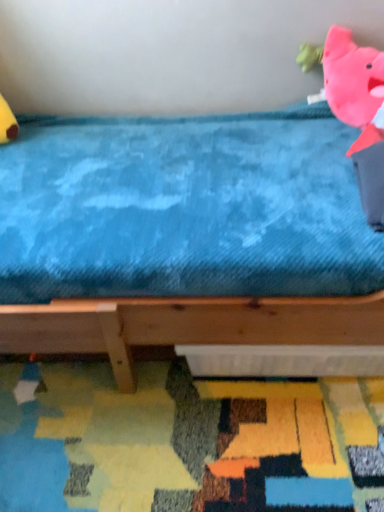
Question: Is pink plush toy at upper right at the right side of textured multicolored mat at lower center?

Choices:
 (A) yes
 (B) no

Answer: (A)

Question: Considering the relative sizes of pink plush toy at upper right and textured multicolored mat at lower center in the image provided, is pink plush toy at upper right wider than textured multicolored mat at lower center?

Choices:
 (A) yes
 (B) no

Answer: (B)

Question: Could you tell me if pink plush toy at upper right is turned towards textured multicolored mat at lower center?

Choices:
 (A) yes
 (B) no

Answer: (B)

Question: Does pink plush toy at upper right have a lesser height compared to textured multicolored mat at lower center?

Choices:
 (A) yes
 (B) no

Answer: (B)

Question: Considering the relative sizes of pink plush toy at upper right and textured multicolored mat at lower center in the image provided, is pink plush toy at upper right smaller than textured multicolored mat at lower center?

Choices:
 (A) yes
 (B) no

Answer: (A)

Question: Considering the positions of point (357, 481) and point (19, 200), is point (357, 481) closer or farther from the camera than point (19, 200)?

Choices:
 (A) farther
 (B) closer

Answer: (B)

Question: Is textured multicolored mat at lower center spatially inside blue plush bed at upper center, or outside of it?

Choices:
 (A) inside
 (B) outside

Answer: (B)

Question: Considering the positions of textured multicolored mat at lower center and blue plush bed at upper center in the image, is textured multicolored mat at lower center wider or thinner than blue plush bed at upper center?

Choices:
 (A) wide
 (B) thin

Answer: (B)

Question: Considering the positions of textured multicolored mat at lower center and blue plush bed at upper center in the image, is textured multicolored mat at lower center taller or shorter than blue plush bed at upper center?

Choices:
 (A) tall
 (B) short

Answer: (B)

Question: Is blue plush bed at upper center inside or outside of pink plush toy at upper right?

Choices:
 (A) inside
 (B) outside

Answer: (B)

Question: Does point (198, 168) appear closer or farther from the camera than point (352, 72)?

Choices:
 (A) closer
 (B) farther

Answer: (A)

Question: Considering the positions of blue plush bed at upper center and pink plush toy at upper right in the image, is blue plush bed at upper center wider or thinner than pink plush toy at upper right?

Choices:
 (A) thin
 (B) wide

Answer: (B)

Question: From their relative heights in the image, would you say blue plush bed at upper center is taller or shorter than pink plush toy at upper right?

Choices:
 (A) short
 (B) tall

Answer: (B)

Question: Considering the positions of textured multicolored mat at lower center and pink plush toy at upper right in the image, is textured multicolored mat at lower center taller or shorter than pink plush toy at upper right?

Choices:
 (A) short
 (B) tall

Answer: (A)

Question: Based on their sizes in the image, would you say textured multicolored mat at lower center is bigger or smaller than pink plush toy at upper right?

Choices:
 (A) small
 (B) big

Answer: (B)